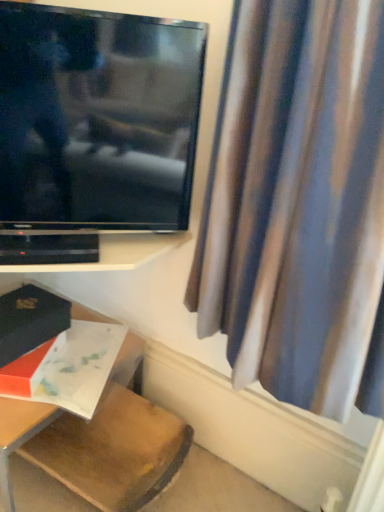
The width and height of the screenshot is (384, 512). What are the coordinates of `free space above wooden table at lower left (from a real-world perspective)` in the screenshot? It's located at (68, 366).